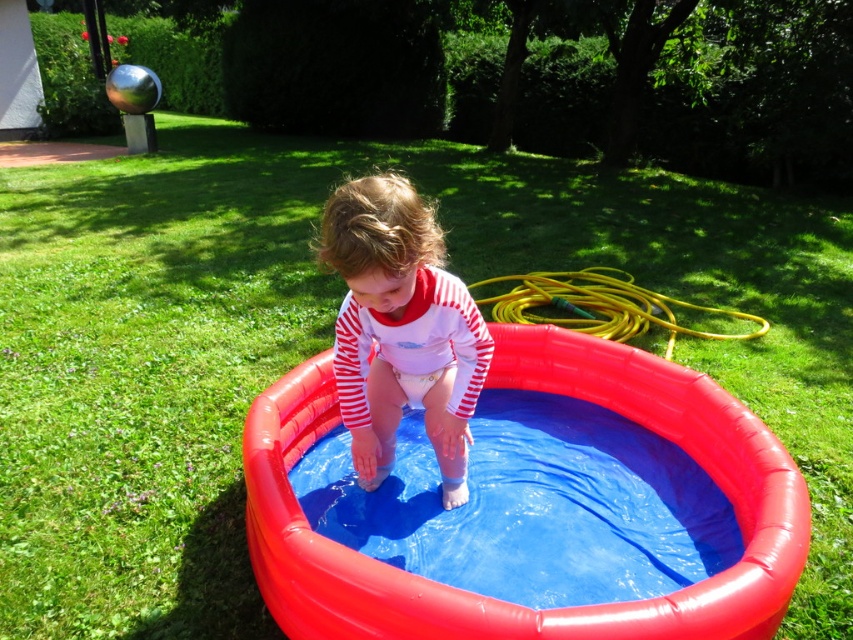
From the picture: You are a parent trying to ensure your child stays safe near the pool. Given the sizes of the rubber inflatable pool at center and the white striped shirt at center, which object is shorter and might require closer supervision to prevent the child from climbing out?

The rubber inflatable pool at center is shorter than the white striped shirt at center. Since the pool is lower, the child might need closer supervision to prevent them from climbing out easily.

You are a photographer taking a picture of the child in the inflatable pool. You want to focus on the white striped shirt at center and the yellow rubber hose at upper right. Which object should you adjust your camera focus on first if you want to ensure both are in focus?

The white striped shirt at center is closer to the viewer than the yellow rubber hose at upper right, so you should focus on the white striped shirt at center first to ensure both are in focus.

A photographer wants to take a closeup of the white striped shirt at center without including the pool or the child. Given that the camera can focus on objects within 1 meter, will the photographer need to move closer or farther away?

The white striped shirt at center is 1.53 meters away from the camera. Since the camera can focus within 1 meter, the photographer needs to move closer to get within 1 meter to take the closeup without including the pool or the child.